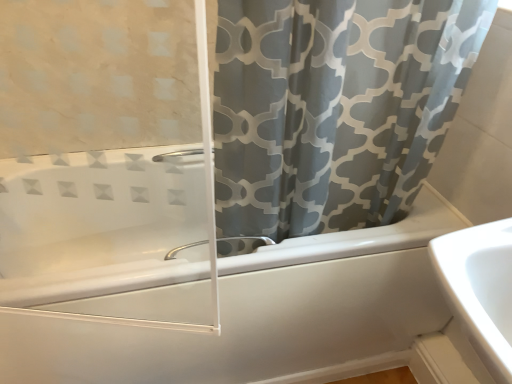
Question: Can you confirm if white glossy bathtub at center is positioned to the left of gray fabric curtain at upper right?

Choices:
 (A) yes
 (B) no

Answer: (A)

Question: From a real-world perspective, does white glossy bathtub at center stand above gray fabric curtain at upper right?

Choices:
 (A) no
 (B) yes

Answer: (A)

Question: Is white glossy bathtub at center located outside gray fabric curtain at upper right?

Choices:
 (A) no
 (B) yes

Answer: (B)

Question: Considering the relative positions of white glossy bathtub at center and gray fabric curtain at upper right in the image provided, is white glossy bathtub at center behind gray fabric curtain at upper right?

Choices:
 (A) yes
 (B) no

Answer: (A)

Question: Is white glossy bathtub at center closer to camera compared to gray fabric curtain at upper right?

Choices:
 (A) yes
 (B) no

Answer: (B)

Question: Can you confirm if white glossy bathtub at center is bigger than gray fabric curtain at upper right?

Choices:
 (A) yes
 (B) no

Answer: (A)

Question: Would you say gray fabric curtain at upper right is a long distance from satin nickel faucet at lower center?

Choices:
 (A) no
 (B) yes

Answer: (A)

Question: Does gray fabric curtain at upper right come in front of satin nickel faucet at lower center?

Choices:
 (A) no
 (B) yes

Answer: (B)

Question: From a real-world perspective, does gray fabric curtain at upper right sit lower than satin nickel faucet at lower center?

Choices:
 (A) yes
 (B) no

Answer: (B)

Question: From the image's perspective, is gray fabric curtain at upper right located beneath satin nickel faucet at lower center?

Choices:
 (A) yes
 (B) no

Answer: (B)

Question: Considering the relative sizes of gray fabric curtain at upper right and satin nickel faucet at lower center in the image provided, is gray fabric curtain at upper right smaller than satin nickel faucet at lower center?

Choices:
 (A) no
 (B) yes

Answer: (A)

Question: Would you say gray fabric curtain at upper right is outside satin nickel faucet at lower center?

Choices:
 (A) yes
 (B) no

Answer: (A)

Question: Is satin nickel faucet at lower center smaller than gray fabric curtain at upper right?

Choices:
 (A) yes
 (B) no

Answer: (A)